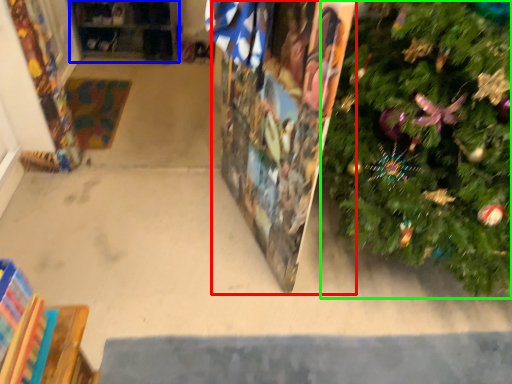
Question: Which is farther away from bulletin board (highlighted by a red box)? shelf (highlighted by a blue box) or christmas tree (highlighted by a green box)?

Choices:
 (A) shelf
 (B) christmas tree

Answer: (A)